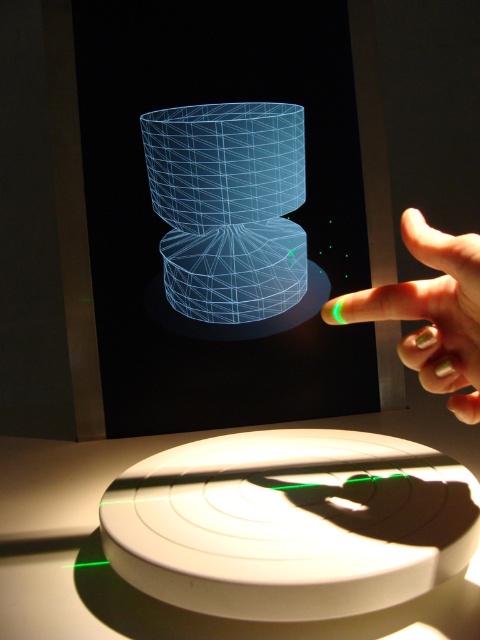
Can you confirm if transparent wireframe cylinder at center is shorter than green matte nail polish at upper right?

Incorrect, transparent wireframe cylinder at center's height does not fall short of green matte nail polish at upper right's.

This screenshot has width=480, height=640. What do you see at coordinates (287, 216) in the screenshot? I see `transparent wireframe cylinder at center` at bounding box center [287, 216].

The width and height of the screenshot is (480, 640). Find the location of `transparent wireframe cylinder at center`. transparent wireframe cylinder at center is located at coordinates (287, 216).